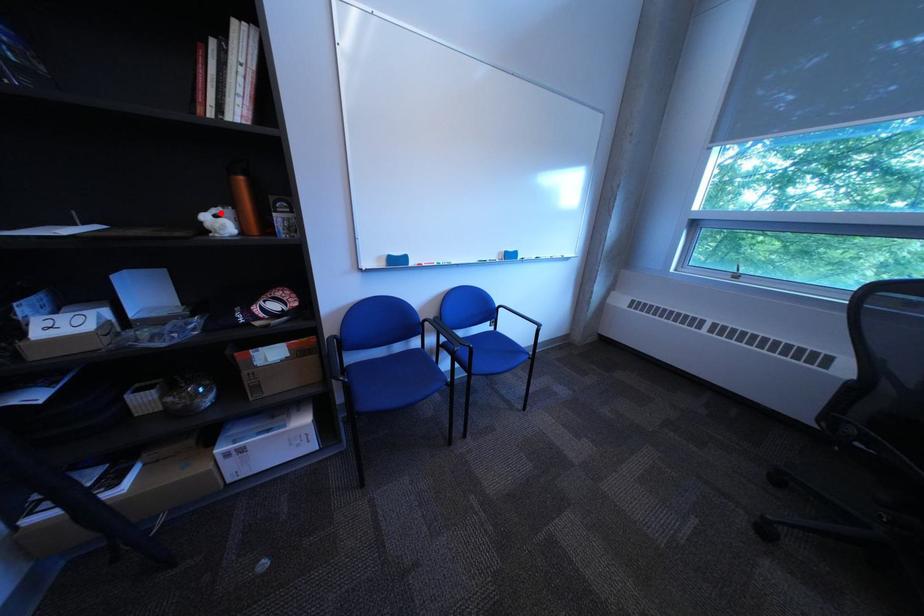
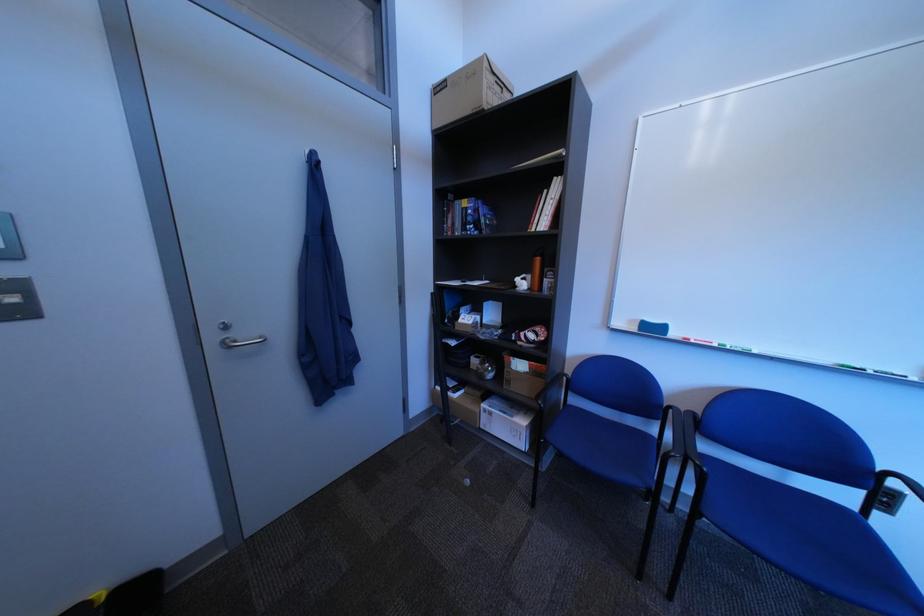
Question: I am providing you with two images of the same scene from different viewpoints. A red point is marked on the first image. Can you still see the location of the red point in image 2?

Choices:
 (A) Yes
 (B) No

Answer: (A)